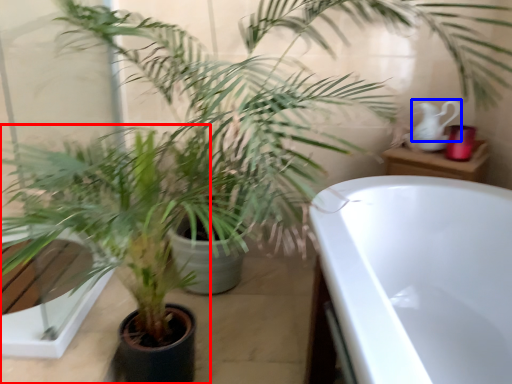
Question: Among these objects, which one is farthest to the camera, houseplant (highlighted by a red box) or tea pot (highlighted by a blue box)?

Choices:
 (A) houseplant
 (B) tea pot

Answer: (B)